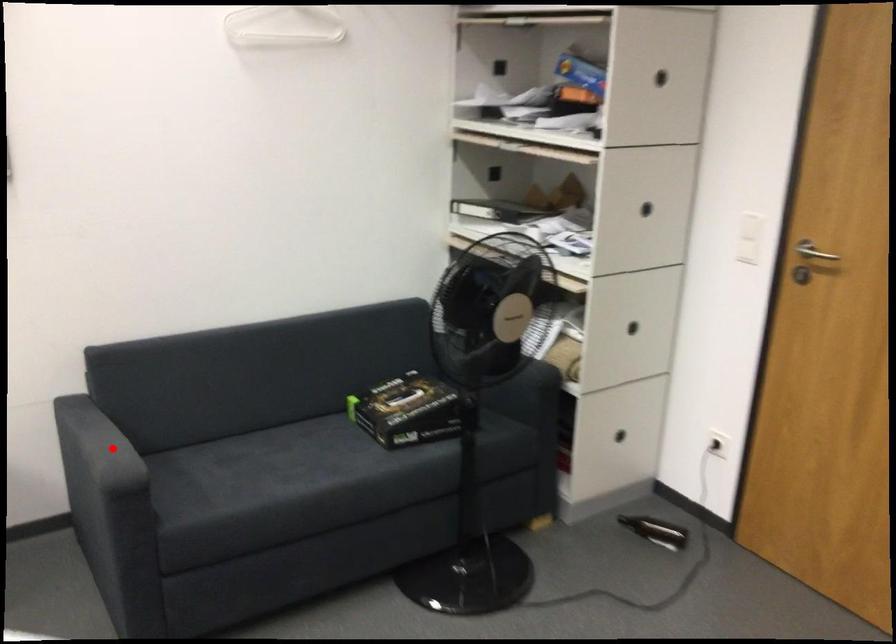
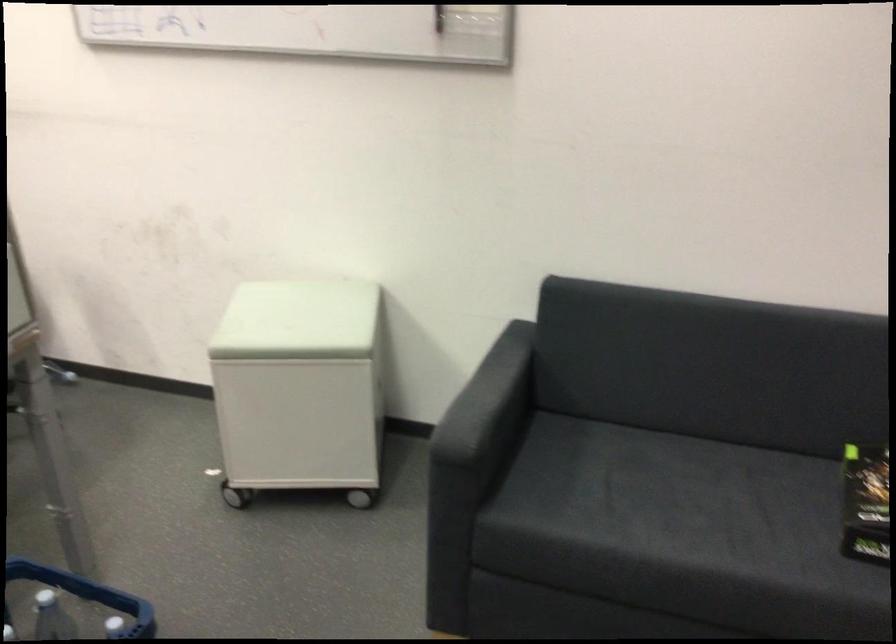
In the second image, find the point that corresponds to the highlighted location in the first image.

(487, 401)